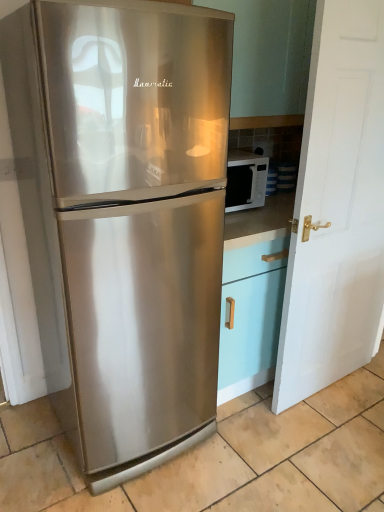
What is the approximate width of white glossy microwave at right?

It is 12.03 inches.

Describe the element at coordinates (124, 217) in the screenshot. This screenshot has height=512, width=384. I see `stainless steel refrigerator at left` at that location.

You are a GUI agent. You are given a task and a screenshot of the screen. Output one action in this format:
    pyautogui.click(x=<x>, y=<y>)
    Task: Click on the white glossy microwave at right
    The height and width of the screenshot is (512, 384).
    Given the screenshot: What is the action you would take?
    point(245,180)

From a real-world perspective, relative to stainless steel refrigerator at left, is white glossy microwave at right vertically above or below?

white glossy microwave at right is above stainless steel refrigerator at left.

Does point (256, 154) lie in front of point (99, 362)?

No, it is not.

Is white glossy microwave at right inside or outside of stainless steel refrigerator at left?

white glossy microwave at right is not inside stainless steel refrigerator at left, it's outside.

What's the angular difference between white glossy microwave at right and stainless steel refrigerator at left's facing directions?

The angle between the facing direction of white glossy microwave at right and the facing direction of stainless steel refrigerator at left is 0.169 degrees.

Is point (330, 266) farther from camera compared to point (260, 167)?

No.

At what (x,y) coordinates should I click in order to perform the action: click on microwave oven behind the white matte door at right. Please return your answer as a coordinate pair (x, y). Image resolution: width=384 pixels, height=512 pixels. Looking at the image, I should click on (245, 180).

Which is in front, white matte door at right or white glossy microwave at right?

white matte door at right.

From the image's perspective, which one is positioned higher, white matte door at right or white glossy microwave at right?

white glossy microwave at right.

Which object is closer to the camera, white matte door at right or stainless steel refrigerator at left?

stainless steel refrigerator at left.

Is white matte door at right next to stainless steel refrigerator at left?

No, white matte door at right is not in contact with stainless steel refrigerator at left.

How different are the orientations of white matte door at right and stainless steel refrigerator at left in degrees?

1.02 degrees.

Between white matte door at right and stainless steel refrigerator at left, which one appears on the right side from the viewer's perspective?

Positioned to the right is white matte door at right.

Is white glossy microwave at right turned away from white matte door at right?

No, white glossy microwave at right is not facing the opposite direction of white matte door at right.

Where is `door on the right side of white glossy microwave at right`? Image resolution: width=384 pixels, height=512 pixels. door on the right side of white glossy microwave at right is located at coordinates (337, 208).

Is white matte door at right located within white glossy microwave at right?

That's incorrect, white matte door at right is not inside white glossy microwave at right.

Is white glossy microwave at right touching white matte door at right?

No, white glossy microwave at right is not touching white matte door at right.

Does stainless steel refrigerator at left have a lesser height compared to white glossy microwave at right?

In fact, stainless steel refrigerator at left may be taller than white glossy microwave at right.

Does point (187, 445) come in front of point (241, 190)?

Yes, point (187, 445) is closer to viewer.

Between stainless steel refrigerator at left and white glossy microwave at right, which one appears on the left side from the viewer's perspective?

From the viewer's perspective, stainless steel refrigerator at left appears more on the left side.

Is stainless steel refrigerator at left at the left side of white matte door at right?

Correct, you'll find stainless steel refrigerator at left to the left of white matte door at right.

Between stainless steel refrigerator at left and white matte door at right, which one is positioned in front?

stainless steel refrigerator at left.

Is stainless steel refrigerator at left inside the boundaries of white matte door at right, or outside?

The correct answer is: outside.

Does point (121, 397) appear closer or farther from the camera than point (338, 372)?

Point (121, 397) appears to be closer to the viewer than point (338, 372).

Where is `microwave oven above the stainless steel refrigerator at left (from the image's perspective)`? The image size is (384, 512). microwave oven above the stainless steel refrigerator at left (from the image's perspective) is located at coordinates point(245,180).

You are a GUI agent. You are given a task and a screenshot of the screen. Output one action in this format:
    pyautogui.click(x=<x>, y=<y>)
    Task: Click on the door located on the right of white glossy microwave at right
    This screenshot has height=512, width=384.
    Given the screenshot: What is the action you would take?
    pyautogui.click(x=337, y=208)

Estimate the real-world distances between objects in this image. Which object is closer to white glossy microwave at right, white matte door at right or stainless steel refrigerator at left?

The object closer to white glossy microwave at right is white matte door at right.

From the image, which object appears to be nearer to stainless steel refrigerator at left, white glossy microwave at right or white matte door at right?

white matte door at right is closer to stainless steel refrigerator at left.

When comparing their distances from white matte door at right, does white glossy microwave at right or stainless steel refrigerator at left seem further?

stainless steel refrigerator at left is positioned further to the anchor white matte door at right.

When comparing their distances from white glossy microwave at right, does stainless steel refrigerator at left or white matte door at right seem closer?

Among the two, white matte door at right is located nearer to white glossy microwave at right.

Looking at the image, which one is located closer to white matte door at right, stainless steel refrigerator at left or white glossy microwave at right?

white glossy microwave at right lies closer to white matte door at right than the other object.

Which object lies further to the anchor point stainless steel refrigerator at left, white matte door at right or white glossy microwave at right?

white glossy microwave at right.

Locate an element on the screen. microwave oven situated between stainless steel refrigerator at left and white matte door at right from left to right is located at coordinates (245, 180).